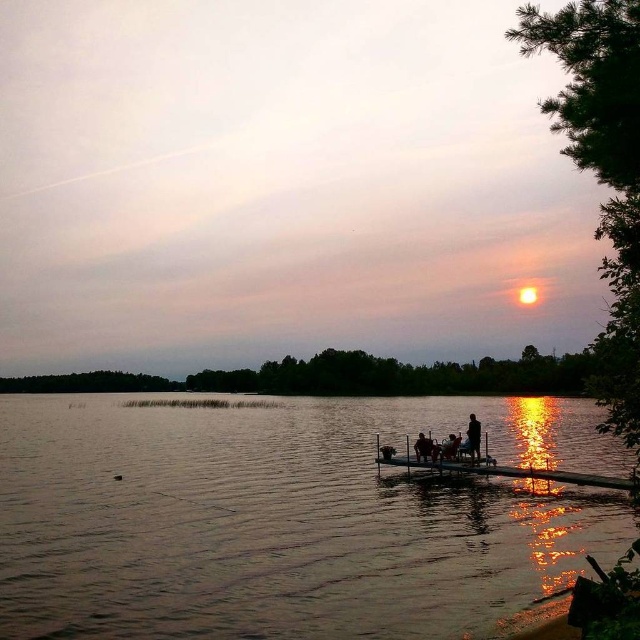
Question: Estimate the real-world distances between objects in this image. Which object is farther from the dark blue fabric jacket at center?

Choices:
 (A) smooth skin person at center
 (B) silhouette figure at center

Answer: (B)

Question: Can you confirm if dark blue fabric jacket at center is smaller than smooth skin person at center?

Choices:
 (A) no
 (B) yes

Answer: (B)

Question: From the image, what is the correct spatial relationship of silhouette figure at center in relation to smooth skin person at center?

Choices:
 (A) below
 (B) above

Answer: (B)

Question: Which point appears farthest from the camera in this image?

Choices:
 (A) (474, 417)
 (B) (416, 445)
 (C) (451, 448)

Answer: (B)

Question: Based on their relative distances, which object is farther from the smooth skin person at center?

Choices:
 (A) dull metallic water at center
 (B) silhouette figure at center
 (C) dark blue fabric jacket at center

Answer: (A)

Question: Is silhouette figure at center above dark blue fabric jacket at center?

Choices:
 (A) yes
 (B) no

Answer: (A)